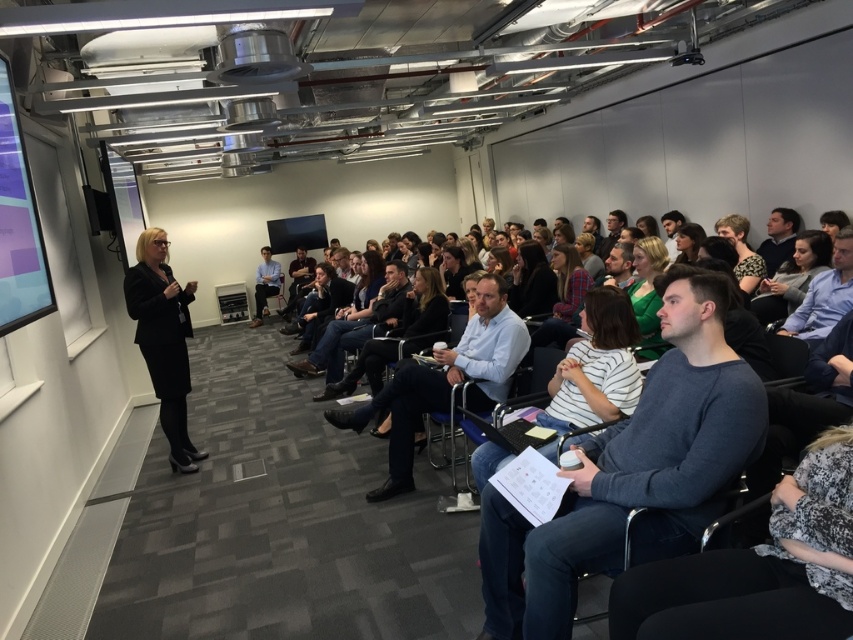
Between black suit at center and green fabric shirt at center, which one is positioned higher?

Positioned higher is green fabric shirt at center.

Does black suit at center have a lesser height compared to green fabric shirt at center?

No.

Is point (131, 292) in front of point (639, 308)?

No, (131, 292) is further to viewer.

The image size is (853, 640). In order to click on black suit at center in this screenshot , I will do `click(163, 339)`.

Does green fabric shirt at center have a lesser height compared to blue shirt at center?

Yes.

Who is taller, green fabric shirt at center or blue shirt at center?

blue shirt at center

Who is more forward, (663, 266) or (257, 321)?

Positioned in front is point (663, 266).

This screenshot has width=853, height=640. Find the location of `green fabric shirt at center`. green fabric shirt at center is located at coordinates (647, 294).

Is point (1, 237) more distant than point (743, 256)?

No, it is not.

The width and height of the screenshot is (853, 640). Identify the location of matte black projection screen at left. (18, 224).

Does point (9, 289) lie in front of point (741, 218)?

That is True.

Where is `matte black projection screen at left`? The width and height of the screenshot is (853, 640). matte black projection screen at left is located at coordinates (18, 224).